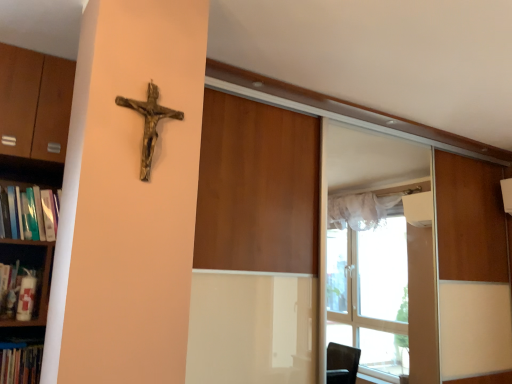
The width and height of the screenshot is (512, 384). Find the location of `white matte shelf at left, the second shelf viewed from the top`. white matte shelf at left, the second shelf viewed from the top is located at coordinates (42, 276).

Does hardcover book at left have a smaller size compared to wooden bookshelf at left, which is counted as the 2th shelf, starting from the bottom?

Indeed, hardcover book at left has a smaller size compared to wooden bookshelf at left, which is counted as the 2th shelf, starting from the bottom.

Is hardcover book at left touching wooden bookshelf at left, which is counted as the 2th shelf, starting from the bottom?

No, hardcover book at left is not making contact with wooden bookshelf at left, which is counted as the 2th shelf, starting from the bottom.

The image size is (512, 384). I want to click on book on the right of wooden bookshelf at left, acting as the 1th shelf starting from the top, so click(x=32, y=213).

Which object is further away from the camera, hardcover book at left or wooden crucifix at upper left?

Positioned behind is hardcover book at left.

From a real-world perspective, is hardcover book at left located beneath wooden crucifix at upper left?

Indeed, from a real-world perspective, hardcover book at left is positioned beneath wooden crucifix at upper left.

Between hardcover book at left and wooden crucifix at upper left, which one has smaller width?

wooden crucifix at upper left is thinner.

Would you consider white matte shelf at left, which appears as the 1th shelf when ordered from the bottom, to be distant from wooden crucifix at upper left?

No, white matte shelf at left, which appears as the 1th shelf when ordered from the bottom, is not far from wooden crucifix at upper left.

Consider the image. From the image's perspective, would you say white matte shelf at left, the second shelf viewed from the top, is shown under wooden crucifix at upper left?

Correct, white matte shelf at left, the second shelf viewed from the top, appears lower than wooden crucifix at upper left in the image.

Is white matte shelf at left, the second shelf viewed from the top, at the left side of wooden crucifix at upper left?

Indeed, white matte shelf at left, the second shelf viewed from the top, is positioned on the left side of wooden crucifix at upper left.

Can you confirm if white matte shelf at left, the second shelf viewed from the top, is shorter than wooden crucifix at upper left?

Correct, white matte shelf at left, the second shelf viewed from the top, is not as tall as wooden crucifix at upper left.

Is point (9, 107) positioned behind point (152, 116)?

Yes, it is behind point (152, 116).

Between wooden bookshelf at left, acting as the 1th shelf starting from the top, and wooden crucifix at upper left, which one is positioned in front?

wooden crucifix at upper left is more forward.

Is wooden crucifix at upper left a part of wooden bookshelf at left, acting as the 1th shelf starting from the top?

Definitely not — wooden crucifix at upper left is not inside wooden bookshelf at left, acting as the 1th shelf starting from the top.

Is white matte shelf at left, which appears as the 1th shelf when ordered from the bottom, positioned before wooden bookshelf at left, which is counted as the 2th shelf, starting from the bottom?

No, white matte shelf at left, which appears as the 1th shelf when ordered from the bottom, is behind wooden bookshelf at left, which is counted as the 2th shelf, starting from the bottom.

Is wooden bookshelf at left, acting as the 1th shelf starting from the top, completely or partially inside white matte shelf at left, the second shelf viewed from the top?

Definitely not — wooden bookshelf at left, acting as the 1th shelf starting from the top, is not inside white matte shelf at left, the second shelf viewed from the top.

Which object is positioned more to the right, white matte shelf at left, the second shelf viewed from the top, or wooden bookshelf at left, acting as the 1th shelf starting from the top?

wooden bookshelf at left, acting as the 1th shelf starting from the top.

Who is taller, white matte shelf at left, which appears as the 1th shelf when ordered from the bottom, or wooden bookshelf at left, which is counted as the 2th shelf, starting from the bottom?

wooden bookshelf at left, which is counted as the 2th shelf, starting from the bottom, is taller.

Considering their positions, is wooden bookshelf at left, which is counted as the 2th shelf, starting from the bottom, located in front of or behind white matte shelf at left, the second shelf viewed from the top?

In the image, wooden bookshelf at left, which is counted as the 2th shelf, starting from the bottom, appears in front of white matte shelf at left, the second shelf viewed from the top.

Does wooden bookshelf at left, acting as the 1th shelf starting from the top, have a larger size compared to white matte shelf at left, which appears as the 1th shelf when ordered from the bottom?

Indeed, wooden bookshelf at left, acting as the 1th shelf starting from the top, has a larger size compared to white matte shelf at left, which appears as the 1th shelf when ordered from the bottom.

Which object is positioned more to the left, wooden bookshelf at left, which is counted as the 2th shelf, starting from the bottom, or white matte shelf at left, the second shelf viewed from the top?

white matte shelf at left, the second shelf viewed from the top, is more to the left.

Is wooden crucifix at upper left touching white matte shelf at left, the second shelf viewed from the top?

No, wooden crucifix at upper left is not touching white matte shelf at left, the second shelf viewed from the top.

In the image, is wooden crucifix at upper left positioned in front of or behind white matte shelf at left, which appears as the 1th shelf when ordered from the bottom?

Visually, wooden crucifix at upper left is located in front of white matte shelf at left, which appears as the 1th shelf when ordered from the bottom.

Looking at this image, from the image's perspective, who appears lower, wooden crucifix at upper left or white matte shelf at left, which appears as the 1th shelf when ordered from the bottom?

From the image's view, white matte shelf at left, which appears as the 1th shelf when ordered from the bottom, is below.

Locate an element on the screen. the 1st shelf located beneath the hardcover book at left (from a real-world perspective) is located at coordinates (34, 103).

Locate an element on the screen. The height and width of the screenshot is (384, 512). book lying behind the wooden crucifix at upper left is located at coordinates (32, 213).

When comparing their distances from wooden bookshelf at left, acting as the 1th shelf starting from the top, does white matte shelf at left, the second shelf viewed from the top, or wooden crucifix at upper left seem closer?

white matte shelf at left, the second shelf viewed from the top, is positioned closer to the anchor wooden bookshelf at left, acting as the 1th shelf starting from the top.

Based on their spatial positions, is white matte shelf at left, which appears as the 1th shelf when ordered from the bottom, or wooden crucifix at upper left further from hardcover book at left?

The object further to hardcover book at left is wooden crucifix at upper left.

Which object lies further to the anchor point hardcover book at left, wooden bookshelf at left, which is counted as the 2th shelf, starting from the bottom, or wooden crucifix at upper left?

wooden crucifix at upper left.

Considering their positions, is wooden crucifix at upper left positioned closer to wooden bookshelf at left, acting as the 1th shelf starting from the top, than hardcover book at left?

hardcover book at left lies closer to wooden bookshelf at left, acting as the 1th shelf starting from the top, than the other object.

Considering their positions, is white matte shelf at left, which appears as the 1th shelf when ordered from the bottom, positioned further to hardcover book at left than wooden bookshelf at left, acting as the 1th shelf starting from the top?

Based on the image, wooden bookshelf at left, acting as the 1th shelf starting from the top, appears to be further to hardcover book at left.

Estimate the real-world distances between objects in this image. Which object is further from wooden crucifix at upper left, hardcover book at left or white matte shelf at left, the second shelf viewed from the top?

Among the two, white matte shelf at left, the second shelf viewed from the top, is located further to wooden crucifix at upper left.

When comparing their distances from white matte shelf at left, the second shelf viewed from the top, does wooden crucifix at upper left or hardcover book at left seem closer?

hardcover book at left.

Based on their spatial positions, is white matte shelf at left, the second shelf viewed from the top, or wooden bookshelf at left, acting as the 1th shelf starting from the top, closer to wooden crucifix at upper left?

wooden bookshelf at left, acting as the 1th shelf starting from the top, is closer to wooden crucifix at upper left.

This screenshot has height=384, width=512. I want to click on book between white matte shelf at left, which appears as the 1th shelf when ordered from the bottom, and wooden crucifix at upper left from left to right, so click(x=32, y=213).

Locate an element on the screen. book located between wooden bookshelf at left, acting as the 1th shelf starting from the top, and wooden crucifix at upper left in the left-right direction is located at coordinates (32, 213).

At what (x,y) coordinates should I click in order to perform the action: click on shelf between hardcover book at left and white matte shelf at left, which appears as the 1th shelf when ordered from the bottom, vertically. Please return your answer as a coordinate pair (x, y). Looking at the image, I should click on (34, 103).

The image size is (512, 384). In order to click on shelf located between white matte shelf at left, which appears as the 1th shelf when ordered from the bottom, and wooden crucifix at upper left in the left-right direction in this screenshot , I will do `click(34, 103)`.